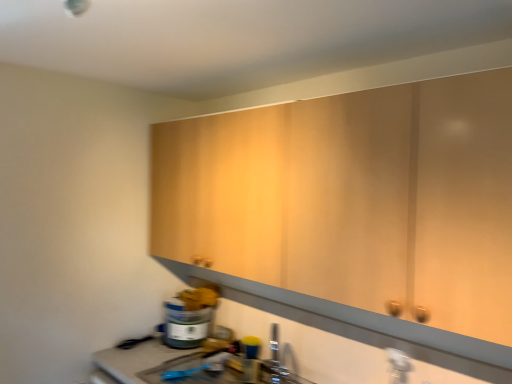
Question: Should I look upward or downward to see matte plastic container at lower left?

Choices:
 (A) down
 (B) up

Answer: (A)